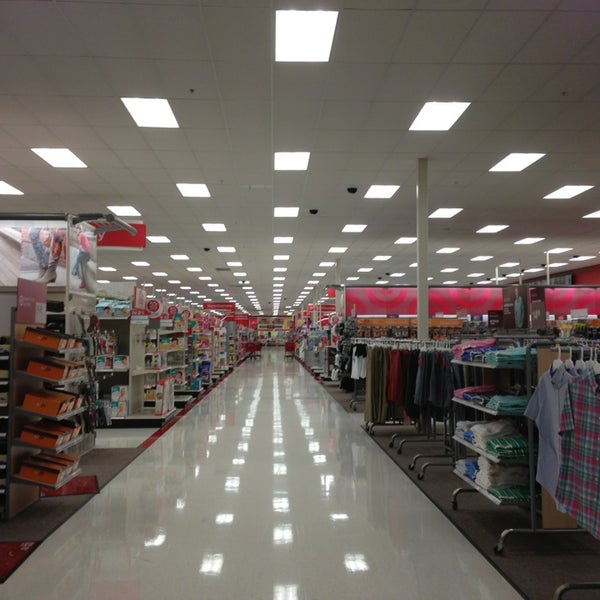
Where is `shirts on shirt rack`? The height and width of the screenshot is (600, 600). shirts on shirt rack is located at coordinates (572, 432).